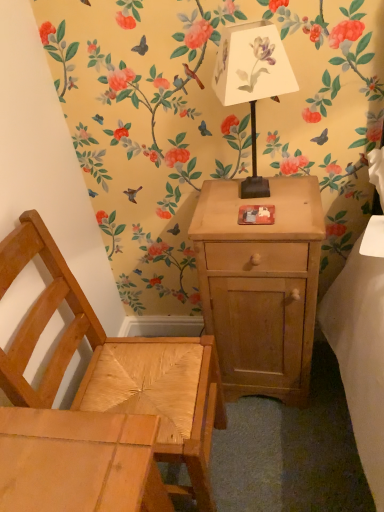
Question: Is natural wood chair at lower left wider or thinner than light brown wood nightstand at center?

Choices:
 (A) thin
 (B) wide

Answer: (B)

Question: From a real-world perspective, relative to light brown wood nightstand at center, is natural wood chair at lower left vertically above or below?

Choices:
 (A) above
 (B) below

Answer: (A)

Question: Estimate the real-world distances between objects in this image. Which object is farther from the light brown wood nightstand at center?

Choices:
 (A) natural wood chair at lower left
 (B) white paper lampshade at upper center

Answer: (B)

Question: Based on their relative distances, which object is farther from the light brown wood nightstand at center?

Choices:
 (A) white paper lampshade at upper center
 (B) natural wood chair at lower left

Answer: (A)